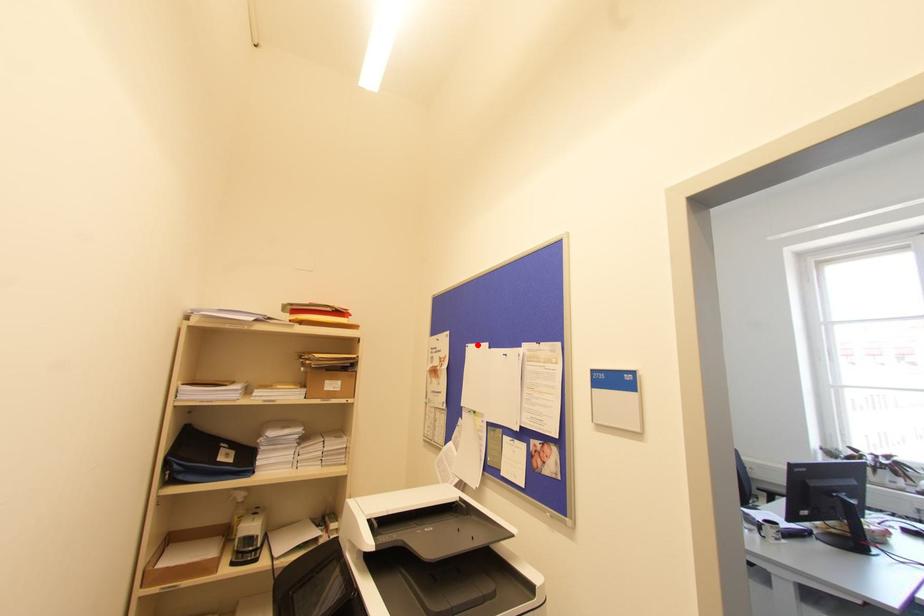
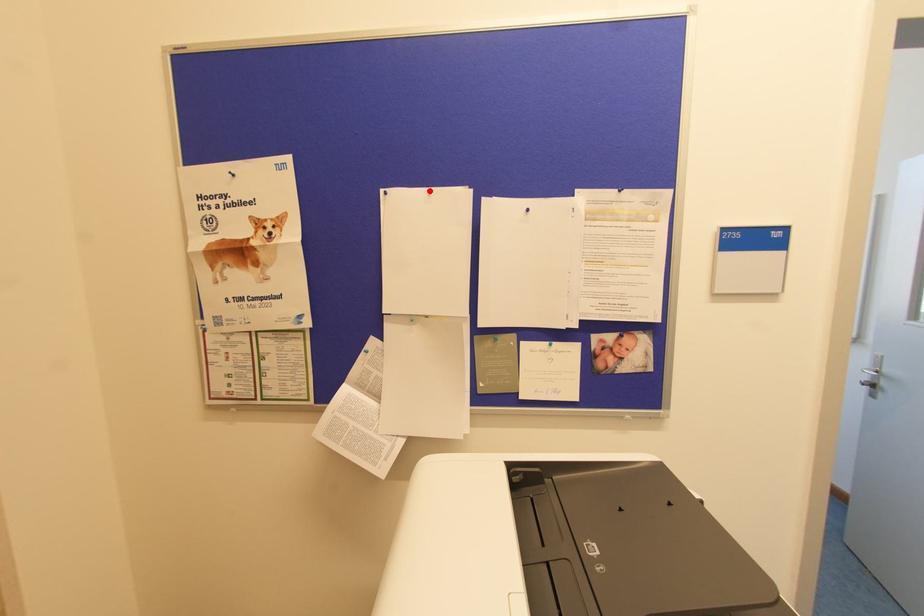
I am providing you with two images of the same scene from different viewpoints. A red point is marked on the first image and another point is marked on the second image. Are the points marked in image1 and image2 representing the same 3D position?

Yes